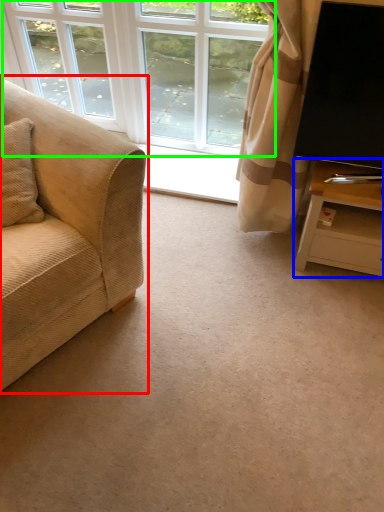
Question: Estimate the real-world distances between objects in this image. Which object is closer to studio couch (highlighted by a red box), table (highlighted by a blue box) or window (highlighted by a green box)?

Choices:
 (A) table
 (B) window

Answer: (A)